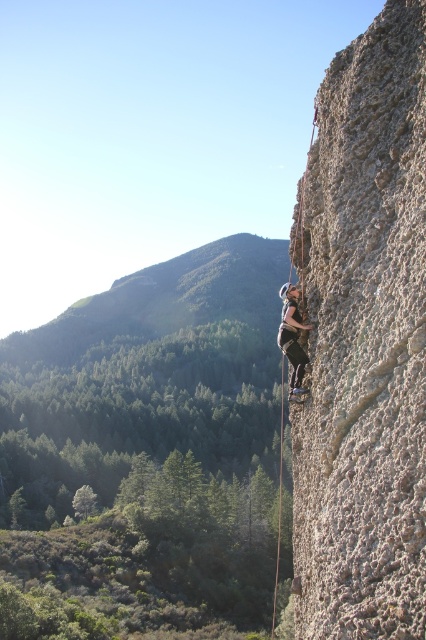
Question: Is gray rough rock at right positioned in front of matte gray helmet at center?

Choices:
 (A) yes
 (B) no

Answer: (A)

Question: Can you confirm if gray rough rock at right is thinner than matte gray helmet at center?

Choices:
 (A) yes
 (B) no

Answer: (B)

Question: Can you confirm if gray rough rock at right is thinner than matte gray helmet at center?

Choices:
 (A) yes
 (B) no

Answer: (B)

Question: Among these objects, which one is nearest to the camera?

Choices:
 (A) gray rough rock at right
 (B) matte gray helmet at center

Answer: (A)

Question: Among these objects, which one is nearest to the camera?

Choices:
 (A) gray rough rock at right
 (B) matte gray helmet at center

Answer: (A)

Question: Which point is closer to the camera taking this photo?

Choices:
 (A) click(362, 566)
 (B) click(290, 333)

Answer: (A)